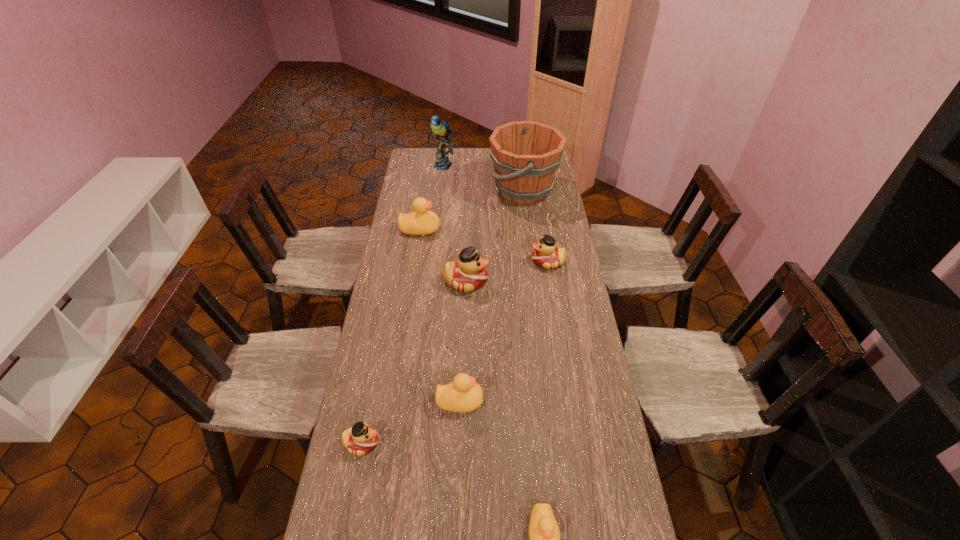
At what (x,y) coordinates should I click in order to perform the action: click on the leftmost red duck. Please return your answer as a coordinate pair (x, y). Image resolution: width=960 pixels, height=540 pixels. Looking at the image, I should click on (360, 439).

This screenshot has width=960, height=540. Find the location of `vacant space located 0.080m on the face of the parrot`. vacant space located 0.080m on the face of the parrot is located at coordinates (441, 181).

Locate an element on the screen. The height and width of the screenshot is (540, 960). free space located 0.100m on the handle side of the bucket is located at coordinates (468, 191).

You are a GUI agent. You are given a task and a screenshot of the screen. Output one action in this format:
    pyautogui.click(x=<x>, y=<y>)
    Task: Click on the free space located 0.280m on the handle side of the bucket
    The height and width of the screenshot is (540, 960).
    Given the screenshot: What is the action you would take?
    pyautogui.click(x=432, y=191)

The height and width of the screenshot is (540, 960). Identify the location of vacant space situated on the handle side of the bucket. (421, 191).

What are the coordinates of `vacant space positioned on the face of the biggest red duck` in the screenshot? It's located at (521, 281).

Identify the location of free space located on the face of the leftmost yellow duck. The width and height of the screenshot is (960, 540). (480, 229).

What are the coordinates of `vacant space located 0.330m on the face of the rightmost duck` in the screenshot? It's located at (451, 262).

Locate an element on the screen. vacant space situated on the face of the rightmost duck is located at coordinates (509, 262).

Locate an element on the screen. The height and width of the screenshot is (540, 960). free space located on the face of the rightmost duck is located at coordinates (477, 262).